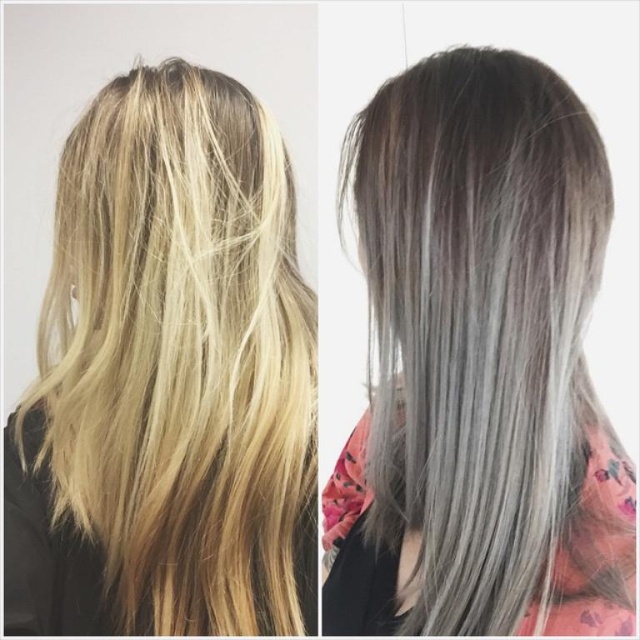
The height and width of the screenshot is (640, 640). Describe the element at coordinates (168, 380) in the screenshot. I see `blonde silky hair at center` at that location.

Is point (180, 195) in front of point (452, 420)?

No, (180, 195) is further to viewer.

Does point (88, 490) lie behind point (372, 572)?

That is False.

This screenshot has width=640, height=640. What are the coordinates of `blonde silky hair at center` in the screenshot? It's located at (168, 380).